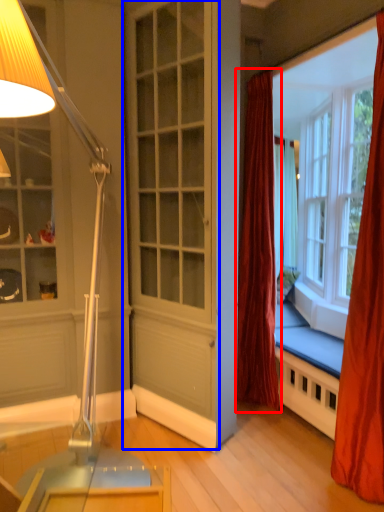
Question: Which point is closer to the camera, curtain (highlighted by a red box) or screen door (highlighted by a blue box)?

Choices:
 (A) curtain
 (B) screen door

Answer: (B)